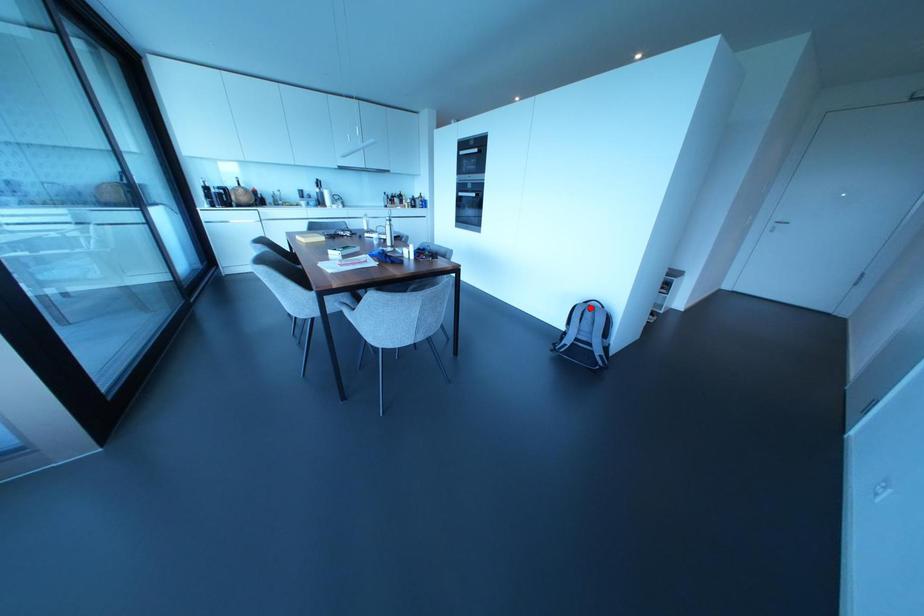
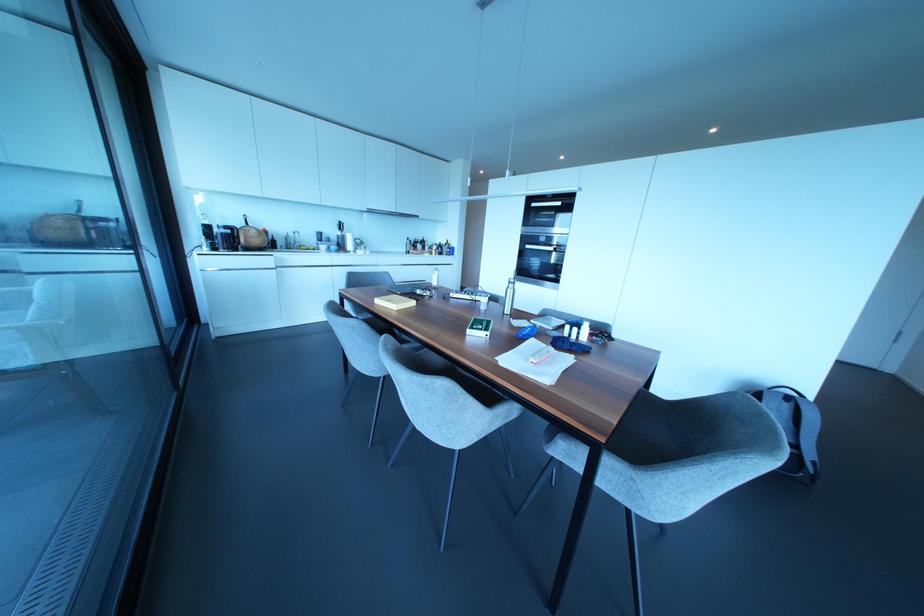
In the second image, find the point that corresponds to the highlighted location in the first image.

(787, 397)